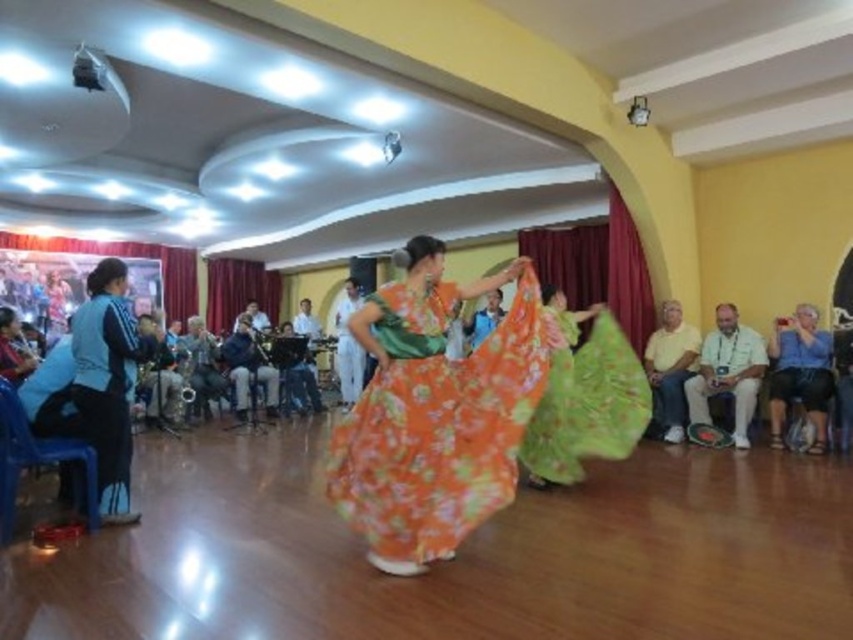
Who is more forward, (157, 369) or (344, 384)?

Point (157, 369)

Between point (151, 314) and point (344, 307), which one is positioned behind?

Positioned behind is point (344, 307).

Locate an element on the screen. matte black saxophone at center is located at coordinates (161, 378).

Is denim jacket at center to the right of matte black camera at lower left from the viewer's perspective?

Yes, denim jacket at center is to the right of matte black camera at lower left.

Measure the distance between point (x=291, y=356) and camera.

Point (x=291, y=356) and camera are 7.91 meters apart.

Find the location of a particular element. This screenshot has height=640, width=853. denim jacket at center is located at coordinates (296, 369).

Does floral cotton skirt at center have a smaller size compared to dark blue fabric at center?

No, floral cotton skirt at center is not smaller than dark blue fabric at center.

You are a GUI agent. You are given a task and a screenshot of the screen. Output one action in this format:
    pyautogui.click(x=<x>, y=<y>)
    Task: Click on the floral cotton skirt at center
    
    Given the screenshot: What is the action you would take?
    pyautogui.click(x=585, y=397)

Image resolution: width=853 pixels, height=640 pixels. Describe the element at coordinates (585, 397) in the screenshot. I see `floral cotton skirt at center` at that location.

Where is `floral cotton skirt at center`? floral cotton skirt at center is located at coordinates (585, 397).